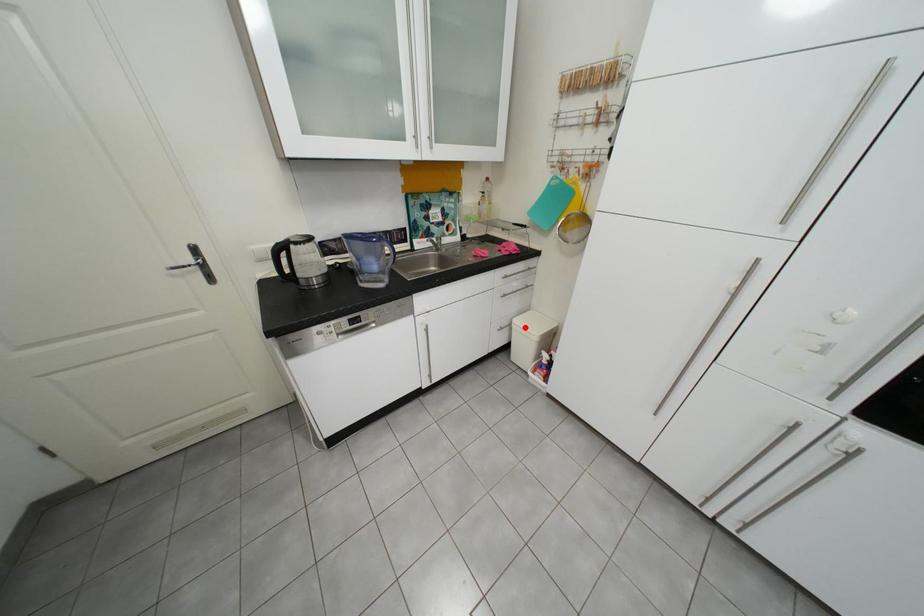
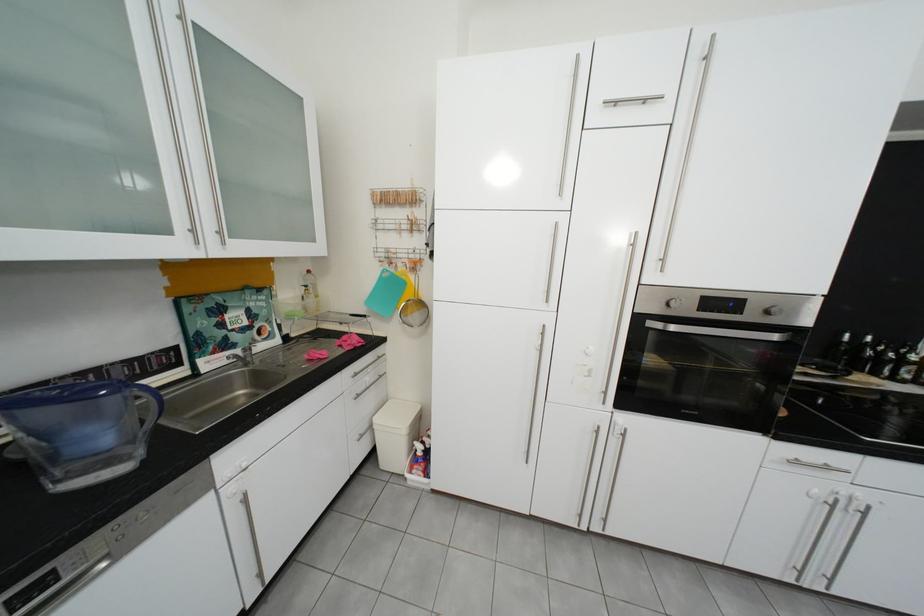
Locate, in the second image, the point that corresponds to the highlighted location in the first image.

(386, 428)